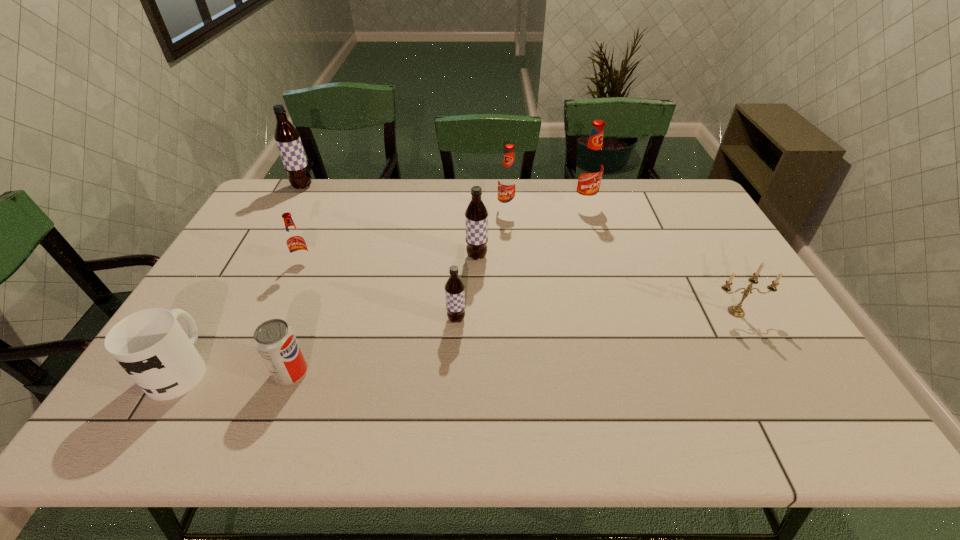
Identify which brown root beer is the second closest to the mug. Please provide its 2D coordinates. Your answer should be formatted as a tuple, i.e. [(x, y)], where the tuple contains the x and y coordinates of a point satisfying the conditions above.

[(476, 215)]

The height and width of the screenshot is (540, 960). Find the location of `the second closest brown root beer to the second nearest brown root beer`. the second closest brown root beer to the second nearest brown root beer is located at coordinates (288, 141).

Select which red root beer is the closest to the sixth object from right to left. Please provide its 2D coordinates. Your answer should be formatted as a tuple, i.e. [(x, y)], where the tuple contains the x and y coordinates of a point satisfying the conditions above.

[(295, 241)]

This screenshot has height=540, width=960. What are the coordinates of `red root beer that is the closest to the mug` in the screenshot? It's located at (295, 241).

Locate an element on the screen. This screenshot has width=960, height=540. free space that satisfies the following two spatial constraints: 1. on the front side of the second smallest red root beer; 2. on the right side of the metallic candle is located at coordinates (515, 312).

I want to click on free space that satisfies the following two spatial constraints: 1. on the back side of the biggest red root beer; 2. on the left side of the second red root beer from right to left, so click(x=506, y=204).

The height and width of the screenshot is (540, 960). Identify the location of vacant space that satisfies the following two spatial constraints: 1. on the handle side of the leftmost red root beer; 2. on the right side of the mug. (243, 264).

This screenshot has height=540, width=960. Identify the location of blank area in the image that satisfies the following two spatial constraints: 1. on the back side of the fourth object from left to right; 2. on the right side of the second root beer from right to left. (351, 210).

The width and height of the screenshot is (960, 540). Identify the location of blank area in the image that satisfies the following two spatial constraints: 1. on the back side of the candle; 2. on the left side of the nearest root beer. (457, 312).